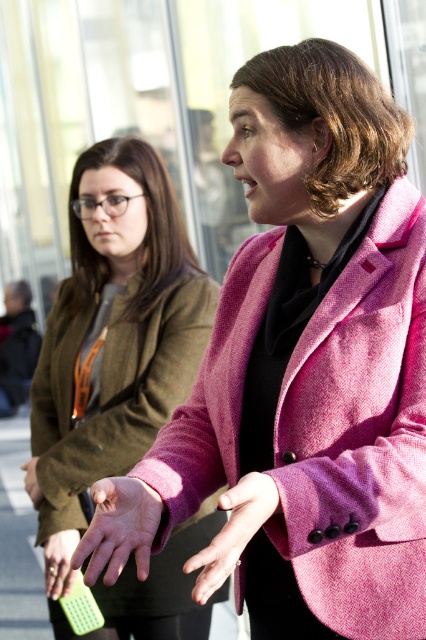
Question: Is green plastic comb at lower left to the left of pale skin hand at center from the viewer's perspective?

Choices:
 (A) yes
 (B) no

Answer: (A)

Question: Among these points, which one is farthest from the camera?

Choices:
 (A) (120, 518)
 (B) (192, 483)
 (C) (219, 628)

Answer: (C)

Question: Which object is the farthest from the knitted wool coat at center?

Choices:
 (A) pale skin hand at center
 (B) pink woolen hand at center

Answer: (B)

Question: Does pale skin hand at center have a larger size compared to pink woolen hand at center?

Choices:
 (A) yes
 (B) no

Answer: (B)

Question: Among these points, which one is nearest to the camera?

Choices:
 (A) (55, 321)
 (B) (62, 577)
 (C) (255, 480)
 (D) (365, 604)

Answer: (C)

Question: Is pink woolen coat at center below pink woolen hand at center?

Choices:
 (A) no
 (B) yes

Answer: (A)